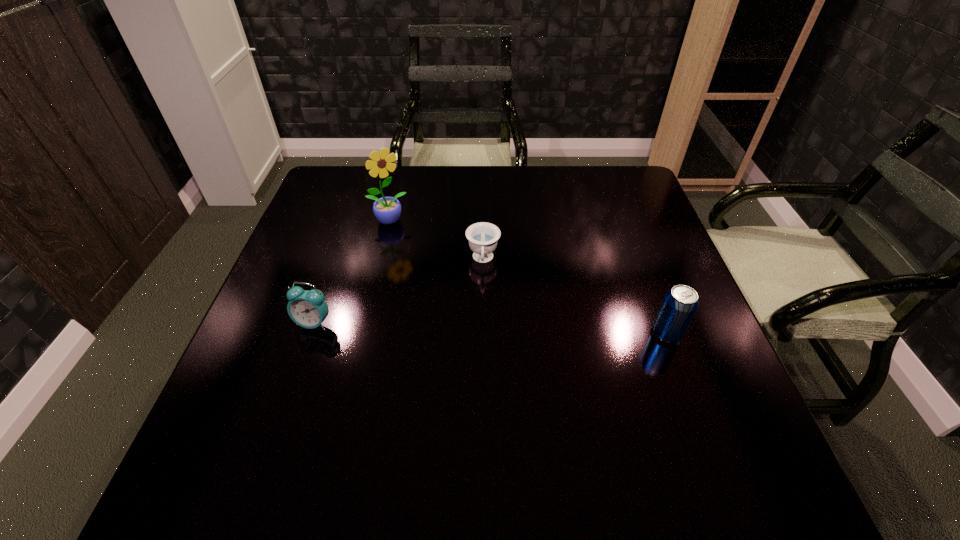
The width and height of the screenshot is (960, 540). I want to click on vacant spot on the desktop that is between the leftmost object and the rightmost object and is positioned on the side of the third object from left to right with the handle, so click(x=481, y=328).

I want to click on vacant spot on the desktop that is between the alarm clock and the beer can and is positioned on the front-facing side of the sunflower, so click(x=462, y=327).